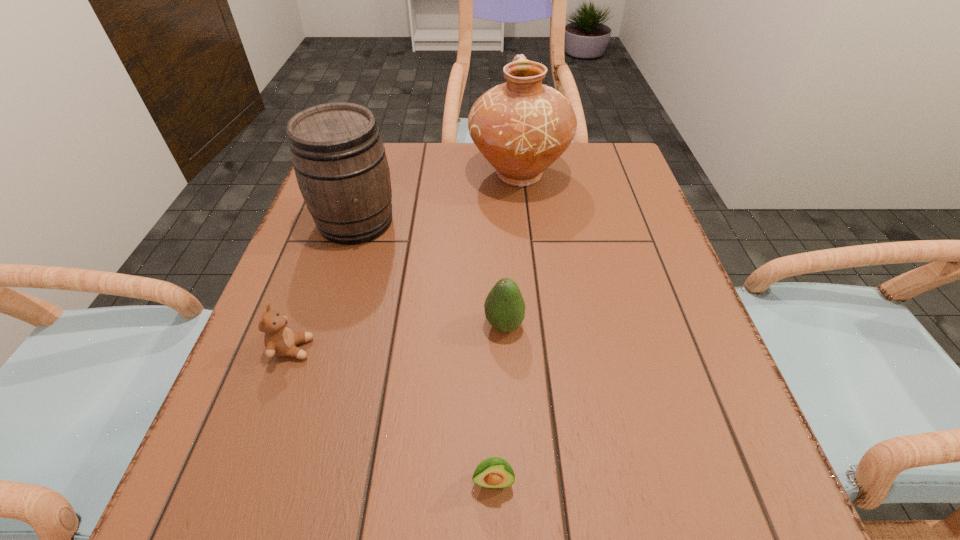
Find the location of a particular element. object located at the near edge is located at coordinates (493, 472).

This screenshot has height=540, width=960. In order to click on wine bucket that is positioned at the left edge in this screenshot , I will do `click(339, 159)`.

This screenshot has height=540, width=960. Identify the location of teddy bear that is at the left edge. (279, 339).

In the image, there is a desktop. Where is `vacant space at the far edge`? The width and height of the screenshot is (960, 540). vacant space at the far edge is located at coordinates (549, 181).

Identify the location of free space at the near edge of the desktop. (622, 471).

In the image, there is a desktop. At what (x,y) coordinates should I click in order to perform the action: click on vacant space at the left edge. Please return your answer as a coordinate pair (x, y). The width and height of the screenshot is (960, 540). Looking at the image, I should click on (341, 294).

Image resolution: width=960 pixels, height=540 pixels. Find the location of `free space at the right edge of the desktop`. free space at the right edge of the desktop is located at coordinates (640, 280).

Identify the location of vacant space at the far right corner of the desktop. This screenshot has width=960, height=540. point(576,177).

In the image, there is a desktop. At what (x,y) coordinates should I click in order to perform the action: click on vacant region at the near right corner. Please return your answer as a coordinate pair (x, y). Image resolution: width=960 pixels, height=540 pixels. Looking at the image, I should click on (668, 484).

Where is `vacant space in between the wine bucket and the taller avocado`? vacant space in between the wine bucket and the taller avocado is located at coordinates [x=430, y=273].